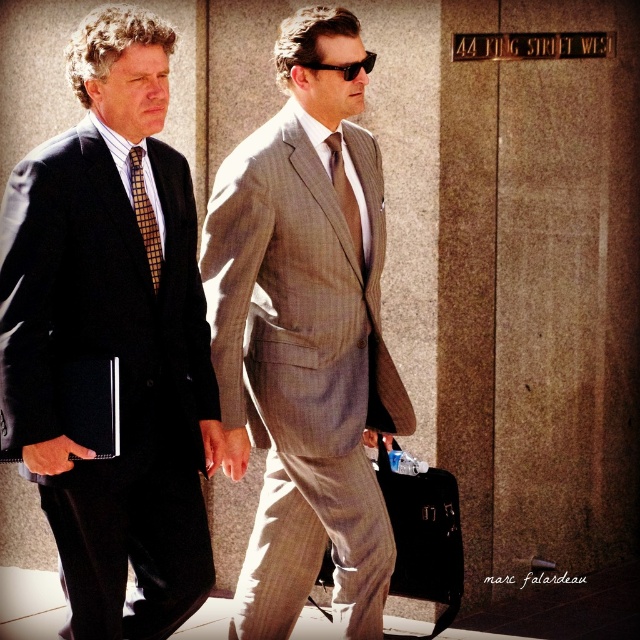
You are a photographer trying to capture a photo of the two men in the scene. You want to ensure that both the matte black suit at left and the black plastic sunglasses at center are clearly visible in the frame. Based on their positions, which object should you focus on first to ensure both are in focus?

The matte black suit at left is positioned on the left side of black plastic sunglasses at center. To ensure both are in focus, you should focus on the matte black suit at left first since it is closer to the photographer and the depth of field will naturally include the black plastic sunglasses at center.

You are a photographer standing 10 feet away from the two men. You want to take a photo of the checkered fabric tie at left and the black plastic sunglasses at center so that both are clearly visible in the frame. Given their distance apart, will you need to adjust your camera angle to capture both objects in the same shot?

The checkered fabric tie at left and black plastic sunglasses at center are 7.11 feet apart. Since you are standing 10 feet away from them, the distance between the two objects is less than your distance from them. This means that with a standard camera angle, both objects should fit within the frame without needing significant adjustment. However, ensure your camera has a wide enough lens to accommodate the 7.11 feet separation at that distance.